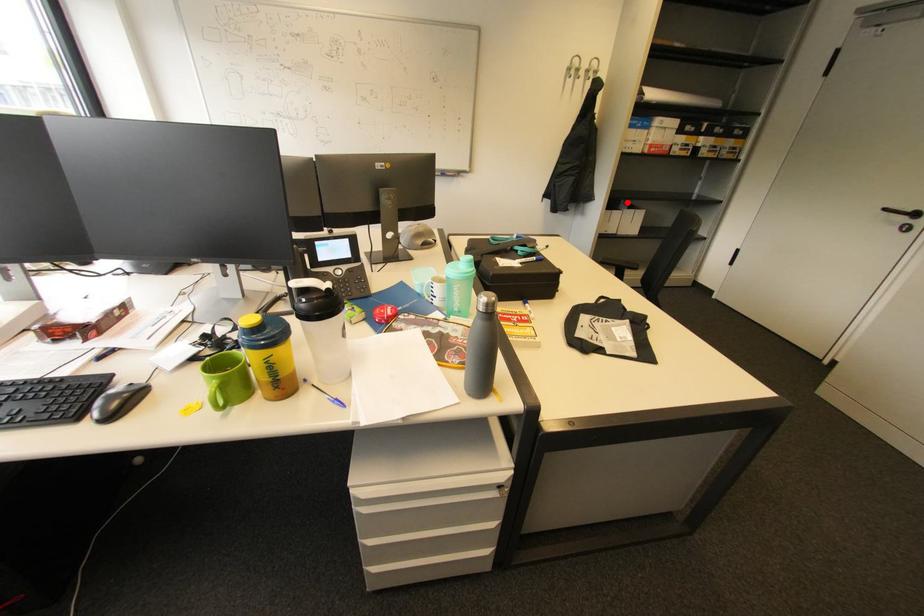
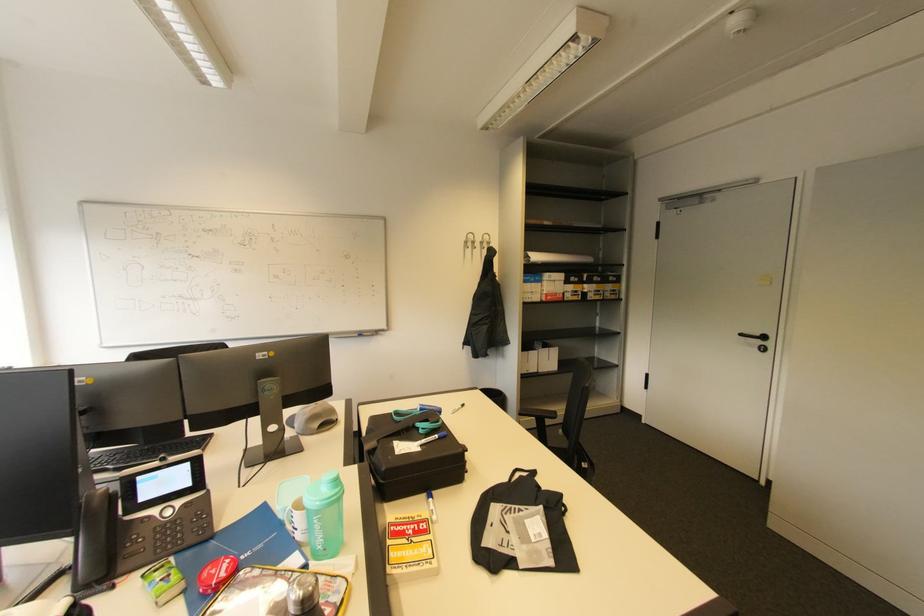
Question: I am providing you with two images of the same scene from different viewpoints. Image1 has a red point marked. In image2, the corresponding 3D location appears at what relative position? Reply with the corresponding letter.

Choices:
 (A) Closer
 (B) Farther

Answer: (B)